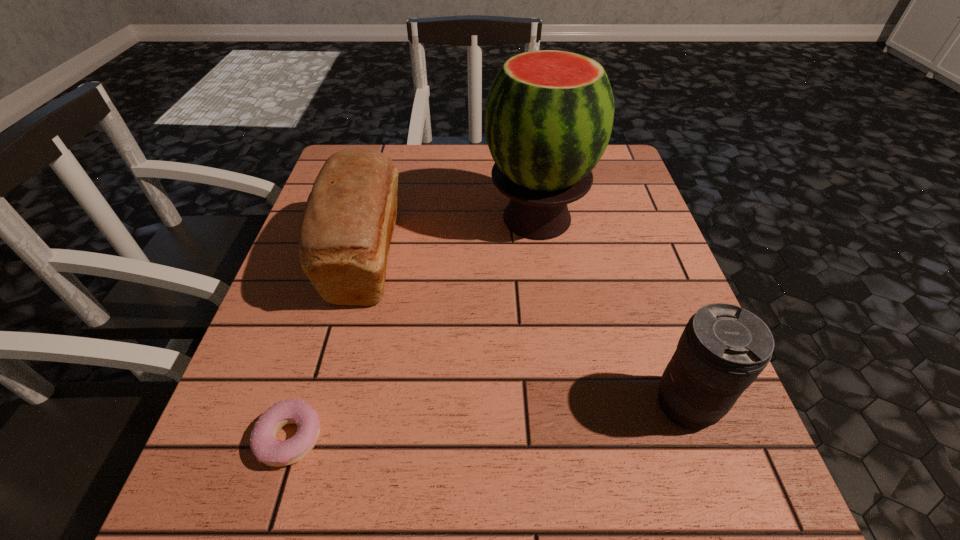
The height and width of the screenshot is (540, 960). I want to click on vacant space located 0.120m on the back of the shortest object, so click(x=319, y=343).

Locate an element on the screen. object present at the far edge is located at coordinates (549, 114).

Locate an element on the screen. object located in the near edge section of the desktop is located at coordinates (263, 443).

The width and height of the screenshot is (960, 540). Identify the location of bread that is at the left edge. pos(347,226).

At what (x,y) coordinates should I click in order to perform the action: click on doughnut present at the left edge. Please return your answer as a coordinate pair (x, y). This screenshot has height=540, width=960. Looking at the image, I should click on (263, 443).

This screenshot has width=960, height=540. What are the coordinates of `watermelon situated at the right edge` in the screenshot? It's located at pyautogui.click(x=549, y=114).

Locate an element on the screen. This screenshot has width=960, height=540. telephoto lens that is at the right edge is located at coordinates (723, 349).

Where is `object that is at the near left corner`? This screenshot has height=540, width=960. object that is at the near left corner is located at coordinates (263, 443).

Identify the location of object that is at the far right corner. The width and height of the screenshot is (960, 540). click(549, 114).

Find the location of a particular element. vacant area at the far edge is located at coordinates (489, 189).